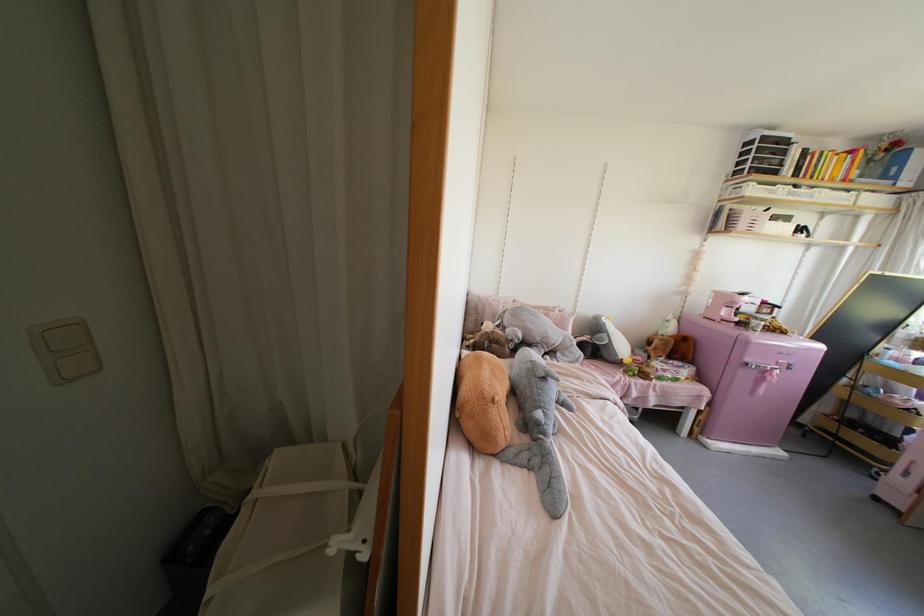
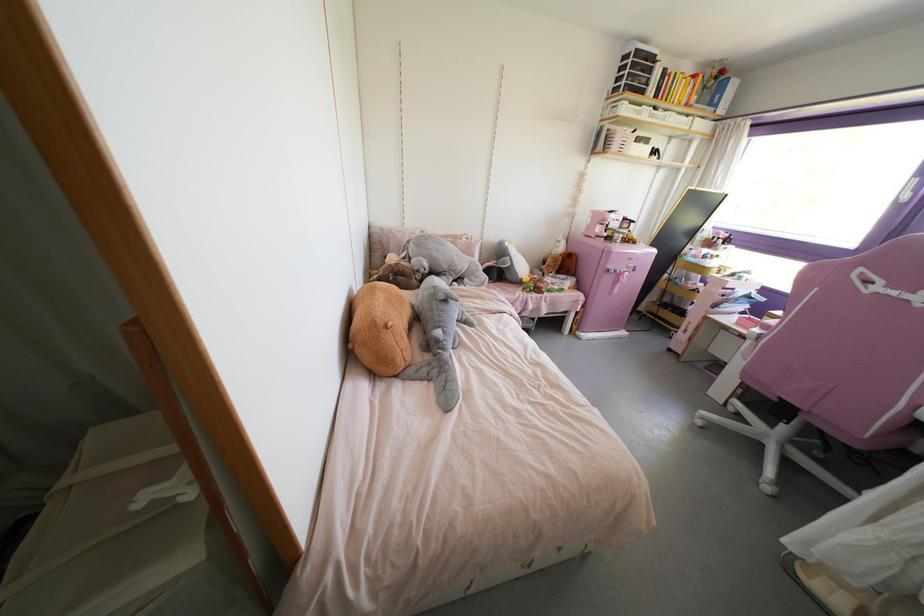
Question: I am providing you with two images of the same scene from different viewpoints. Please identify which objects are invisible in image2.

Choices:
 (A) gray plush toy
 (B) brown plush toy
 (C) white chair armrest
 (D) none of these

Answer: (D)